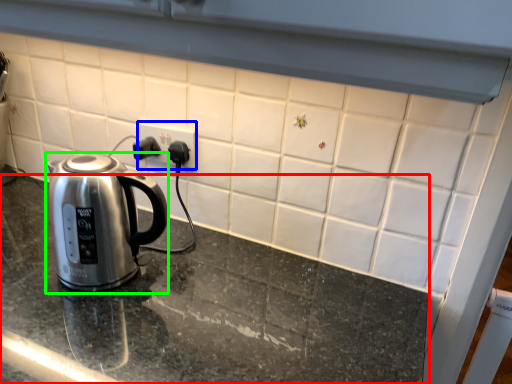
Question: Which is farther away from table top (highlighted by a red box)? electric outlet (highlighted by a blue box) or kettle (highlighted by a green box)?

Choices:
 (A) electric outlet
 (B) kettle

Answer: (A)